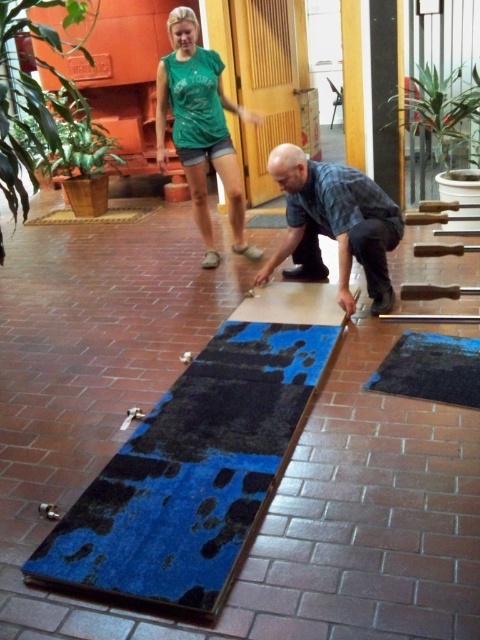
From the picture: Who is shorter, blue felt mat at center or green leafy plant at upper right?

blue felt mat at center is shorter.

Who is more forward, (x=108, y=563) or (x=447, y=141)?

Point (x=108, y=563)

At what (x,y) coordinates should I click in order to perform the action: click on blue felt mat at center. Please return your answer as a coordinate pair (x, y). Looking at the image, I should click on (192, 474).

Which is more to the right, blue fabric at center or blue rubber mat at lower center?

blue rubber mat at lower center is more to the right.

Who is more distant from viewer, [292,236] or [456,337]?

Positioned behind is point [292,236].

Where is `blue fabric at center`? The height and width of the screenshot is (640, 480). blue fabric at center is located at coordinates (334, 225).

Does blue fabric at center have a smaller size compared to green cotton shirt at upper center?

Correct, blue fabric at center occupies less space than green cotton shirt at upper center.

Can you confirm if blue fabric at center is wider than green cotton shirt at upper center?

Correct, the width of blue fabric at center exceeds that of green cotton shirt at upper center.

Identify the location of blue fabric at center. Image resolution: width=480 pixels, height=640 pixels. (334, 225).

The width and height of the screenshot is (480, 640). I want to click on blue fabric at center, so click(x=334, y=225).